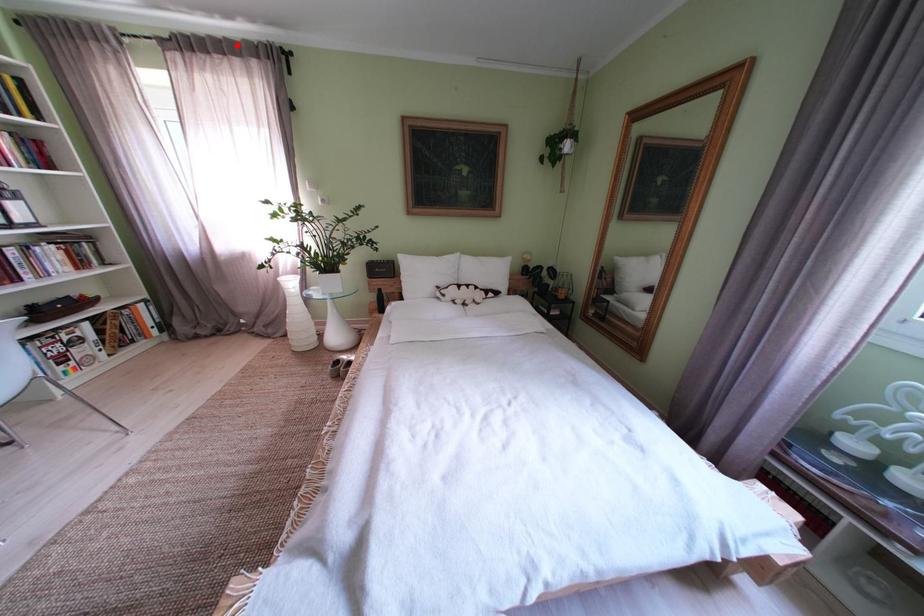
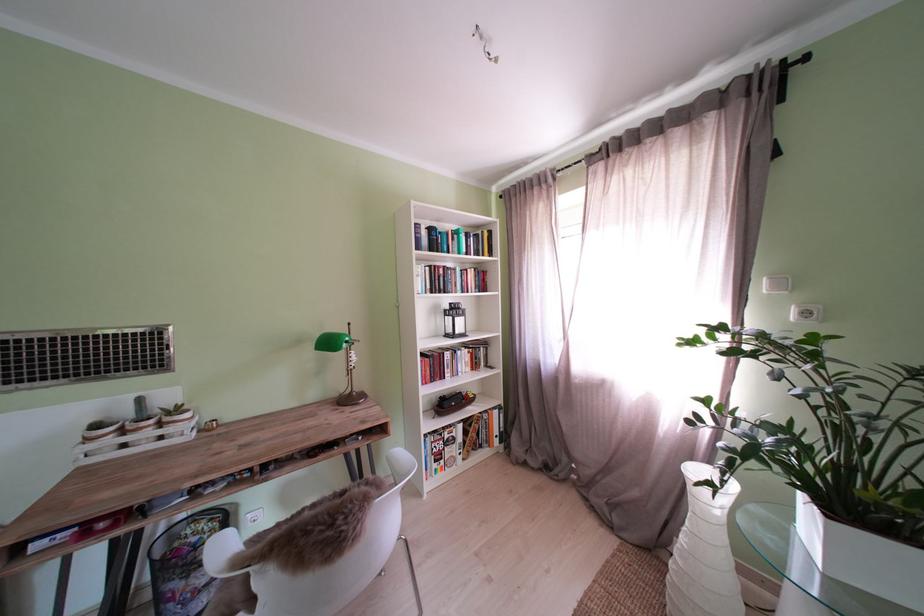
The point at the highlighted location is marked in the first image. Where is the corresponding point in the second image?

(681, 116)